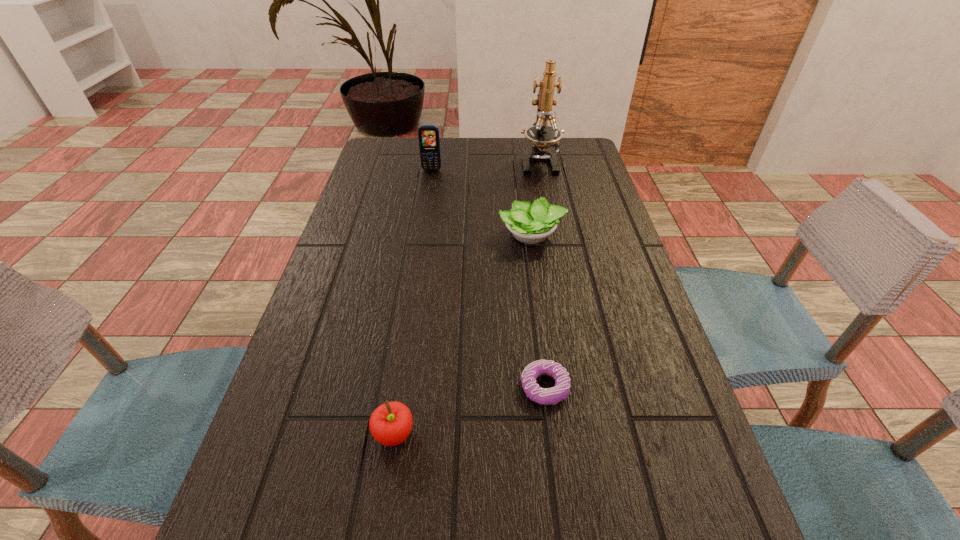
Locate an element on the screen. microscope that is positioned at the far edge is located at coordinates (542, 136).

At what (x,y) coordinates should I click in order to perform the action: click on cellular telephone situated at the far edge. Please return your answer as a coordinate pair (x, y). Looking at the image, I should click on (428, 135).

The height and width of the screenshot is (540, 960). In order to click on microscope that is at the right edge in this screenshot , I will do `click(542, 136)`.

Where is `lettuce that is positioned at the right edge`? The image size is (960, 540). lettuce that is positioned at the right edge is located at coordinates (529, 223).

You are a GUI agent. You are given a task and a screenshot of the screen. Output one action in this format:
    pyautogui.click(x=<x>, y=<y>)
    Task: Click on the object situated at the far right corner
    The height and width of the screenshot is (540, 960).
    Given the screenshot: What is the action you would take?
    pyautogui.click(x=542, y=136)

In the image, there is a desktop. Where is `vacant space at the far edge`? Image resolution: width=960 pixels, height=540 pixels. vacant space at the far edge is located at coordinates (509, 142).

At what (x,y) coordinates should I click in order to perform the action: click on vacant space at the left edge of the desktop. Please return your answer as a coordinate pair (x, y). The height and width of the screenshot is (540, 960). Looking at the image, I should click on (388, 203).

Image resolution: width=960 pixels, height=540 pixels. In order to click on vacant space at the right edge of the desktop in this screenshot , I will do `click(561, 199)`.

Locate an element on the screen. vacant region at the far right corner is located at coordinates (593, 160).

At what (x,y) coordinates should I click in order to perform the action: click on free area in between the doughnut and the lettuce. Please return your answer as a coordinate pair (x, y). The height and width of the screenshot is (540, 960). Looking at the image, I should click on (538, 311).